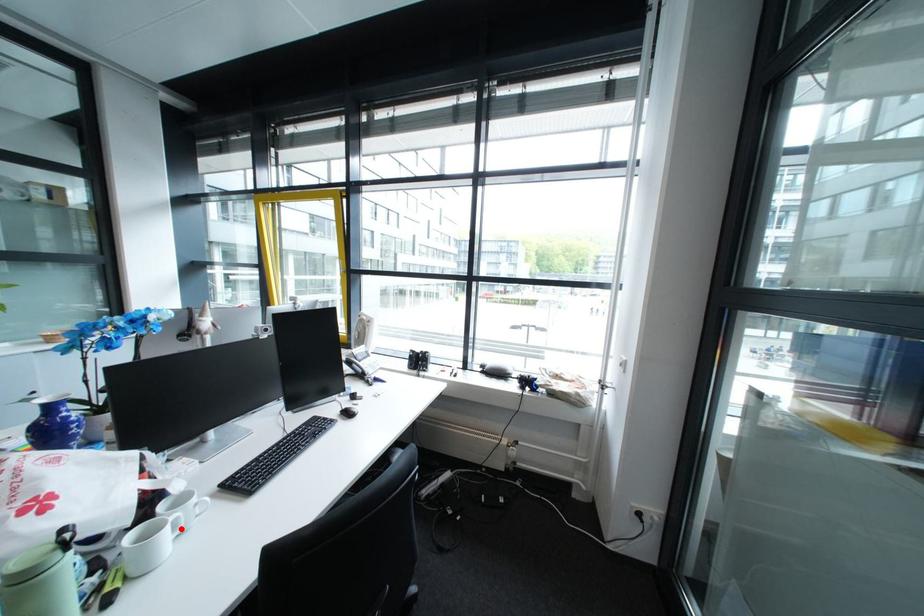
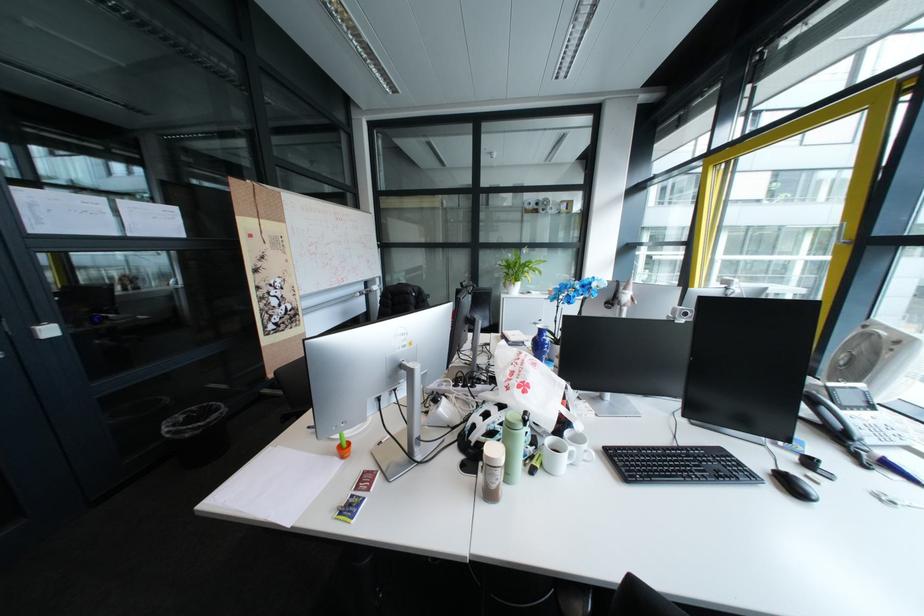
Question: A red point is marked in image1. In image2, is the corresponding 3D point closer to the camera or farther? Reply with the corresponding letter.

Choices:
 (A) The corresponding 3D point is closer.
 (B) The corresponding 3D point is farther.

Answer: (B)